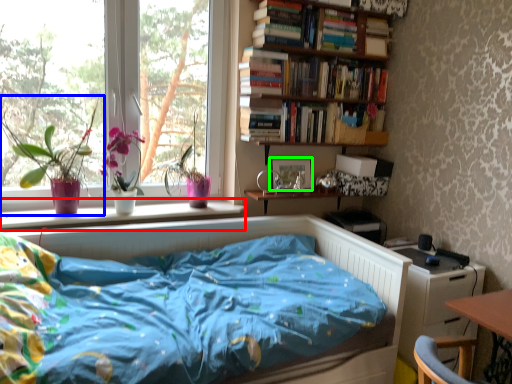
Question: Which object is the closest to the window sill (highlighted by a red box)? Choose among these: houseplant (highlighted by a blue box) or picture frame (highlighted by a green box).

Choices:
 (A) houseplant
 (B) picture frame

Answer: (A)